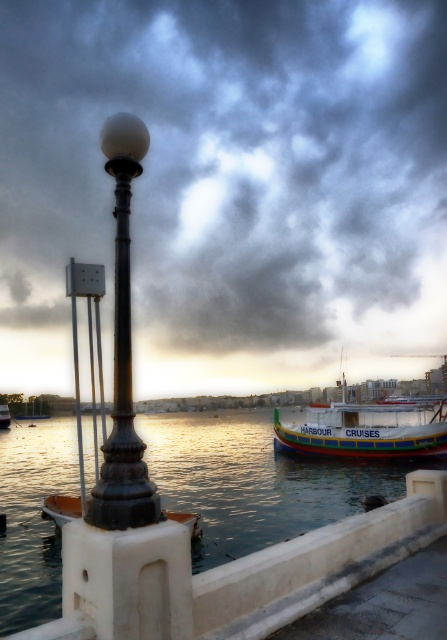
Question: Where is clear water at lower center located in relation to black polished metal lamp post at left in the image?

Choices:
 (A) left
 (B) right

Answer: (B)

Question: Which object is closer to the camera taking this photo?

Choices:
 (A) black polished metal lamp post at left
 (B) matte black lamp post at center
 (C) clear water at lower center
 (D) wooden boat at center

Answer: (A)

Question: Is clear water at lower center smaller than white wooden boat at center?

Choices:
 (A) no
 (B) yes

Answer: (B)

Question: Considering the real-world distances, which object is farthest from the matte black lamp post at center?

Choices:
 (A) white wooden boat at center
 (B) wooden boat at center
 (C) clear water at lower center
 (D) black polished metal lamp post at left

Answer: (D)

Question: Observing the image, what is the correct spatial positioning of matte black lamp post at center in reference to clear water at lower center?

Choices:
 (A) below
 (B) above

Answer: (B)

Question: Estimate the real-world distances between objects in this image. Which object is farther from the wooden boat at center?

Choices:
 (A) black polished metal lamp post at left
 (B) matte black lamp post at center
 (C) clear water at lower center

Answer: (B)